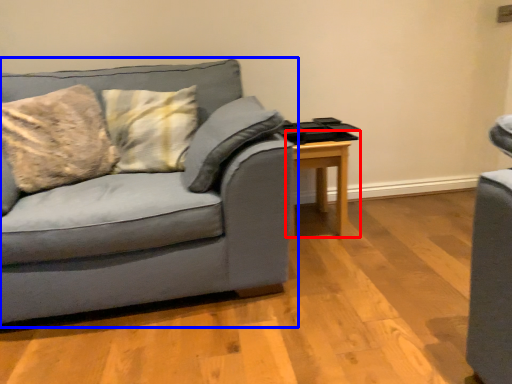
Question: Which object is closer to the camera taking this photo, table (highlighted by a red box) or studio couch (highlighted by a blue box)?

Choices:
 (A) table
 (B) studio couch

Answer: (B)